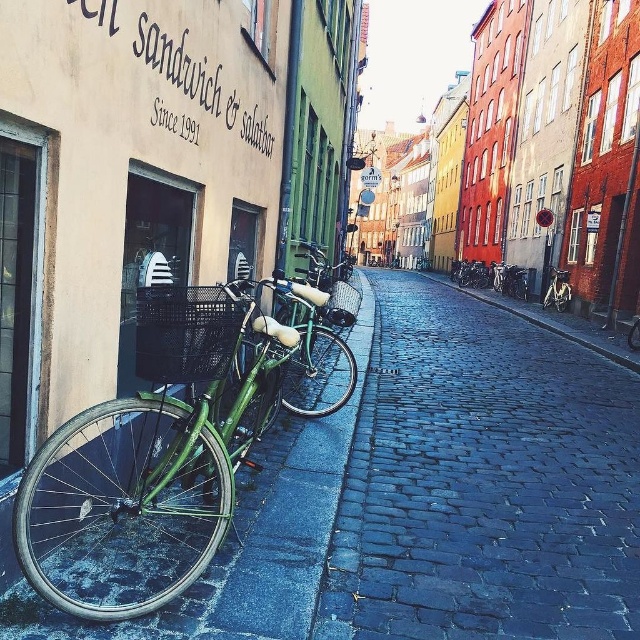
You are a delivery person who needs to park your 2.5 meters long cart between the cobblestone pavement at center and the green matte bicycle at left. Is there enough space for your cart?

The cobblestone pavement at center is wider than the green matte bicycle at left, so there is sufficient space to park the 2.5 meters long cart between them.

You are a delivery person trying to park your bicycle. You see the cobblestone pavement at center and the green matte bicycle at center. Which area is wider for parking?

The cobblestone pavement at center is wider than the green matte bicycle at center, so it would be more suitable for parking.